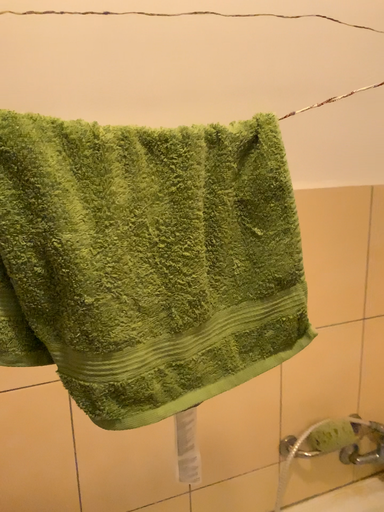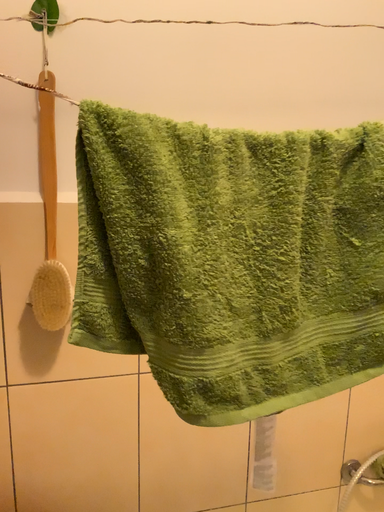
Question: How did the camera likely rotate when shooting the video?

Choices:
 (A) rotated right
 (B) rotated left

Answer: (B)